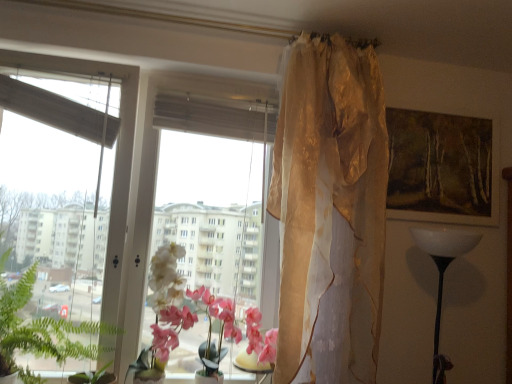
Question: Considering the relative positions of translucent gold curtain at upper center and wooden framed painting at upper right in the image provided, is translucent gold curtain at upper center to the right of wooden framed painting at upper right from the viewer's perspective?

Choices:
 (A) yes
 (B) no

Answer: (B)

Question: Does translucent gold curtain at upper center have a larger size compared to wooden framed painting at upper right?

Choices:
 (A) yes
 (B) no

Answer: (A)

Question: Is wooden framed painting at upper right surrounded by translucent gold curtain at upper center?

Choices:
 (A) yes
 (B) no

Answer: (B)

Question: Considering the relative sizes of translucent gold curtain at upper center and wooden framed painting at upper right in the image provided, is translucent gold curtain at upper center thinner than wooden framed painting at upper right?

Choices:
 (A) yes
 (B) no

Answer: (B)

Question: From a real-world perspective, is translucent gold curtain at upper center located higher than wooden framed painting at upper right?

Choices:
 (A) yes
 (B) no

Answer: (B)

Question: From the image's perspective, relative to translucent glass table at center, is translucent gold curtain at upper center above or below?

Choices:
 (A) above
 (B) below

Answer: (A)

Question: Is point (325, 142) positioned closer to the camera than point (242, 352)?

Choices:
 (A) closer
 (B) farther

Answer: (A)

Question: Based on their sizes in the image, would you say translucent gold curtain at upper center is bigger or smaller than translucent glass table at center?

Choices:
 (A) big
 (B) small

Answer: (A)

Question: In terms of width, does translucent gold curtain at upper center look wider or thinner when compared to translucent glass table at center?

Choices:
 (A) wide
 (B) thin

Answer: (A)

Question: Would you say pink silk orchid at center is inside or outside transparent glass window at center?

Choices:
 (A) inside
 (B) outside

Answer: (A)

Question: From a real-world perspective, is pink silk orchid at center physically located above or below transparent glass window at center?

Choices:
 (A) below
 (B) above

Answer: (A)

Question: Relative to transparent glass window at center, is pink silk orchid at center in front or behind?

Choices:
 (A) front
 (B) behind

Answer: (B)

Question: Does point (272, 337) appear closer or farther from the camera than point (150, 91)?

Choices:
 (A) farther
 (B) closer

Answer: (B)

Question: Do you think translucent glass table at center is within green leafy plant at left, or outside of it?

Choices:
 (A) inside
 (B) outside

Answer: (B)

Question: From their relative heights in the image, would you say translucent glass table at center is taller or shorter than green leafy plant at left?

Choices:
 (A) short
 (B) tall

Answer: (A)